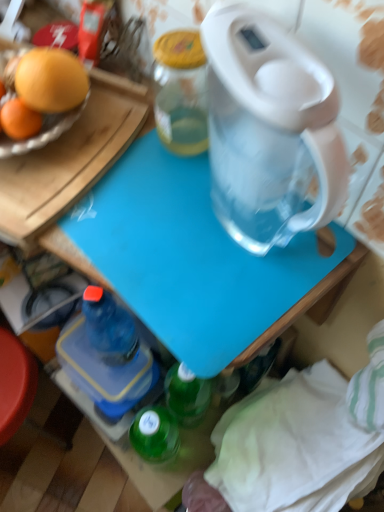
The height and width of the screenshot is (512, 384). What are the coordinates of `blank space situated above blue plastic bottle at lower left (from a real-world perspective)` in the screenshot? It's located at (88, 348).